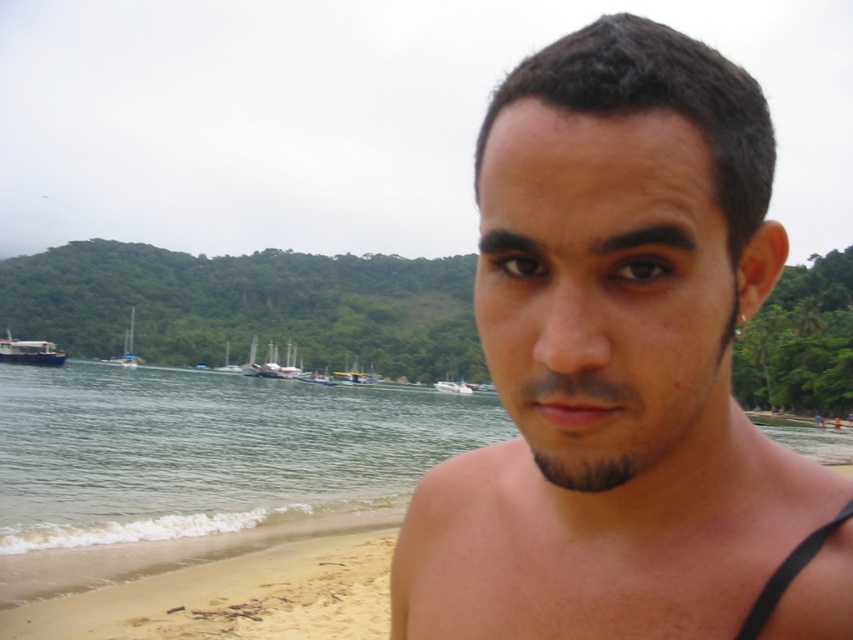
Consider the image. You are a photographer positioned at the origin point of the coordinate system. You want to capture the wooden sailboat at center in your shot. What are the coordinates where you should aim your camera?

The wooden sailboat at center is located at coordinates point (355, 376), so you should aim your camera at those coordinates to capture it.

You are a photographer standing on the beach and want to capture both the wooden sailboat at center and the white glossy boat at center in a single shot. Given that your camera has a maximum focus range of 12 meters, will you be able to get both boats in focus?

The wooden sailboat at center is 13.02 meters from the white glossy boat at center. Since the distance between them exceeds the camera maximum focus range of 12 meters, you cannot get both boats in focus in a single shot.

You are standing at the center of the beach and see the point marked at coordinates (28,352). What object is located at that point?

The point at (28,352) corresponds to the blue glossy boat at left.